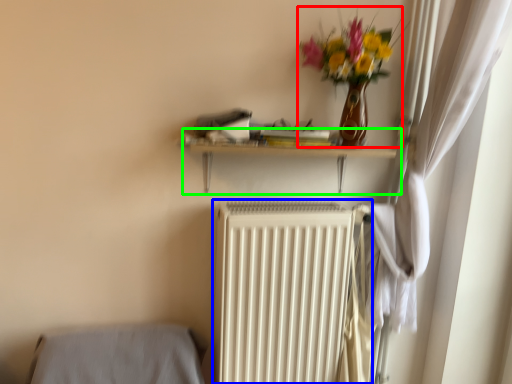
Question: Considering the real-world distances, which object is closest to floral arrangement (highlighted by a red box)? radiator (highlighted by a blue box) or shelf (highlighted by a green box).

Choices:
 (A) radiator
 (B) shelf

Answer: (B)